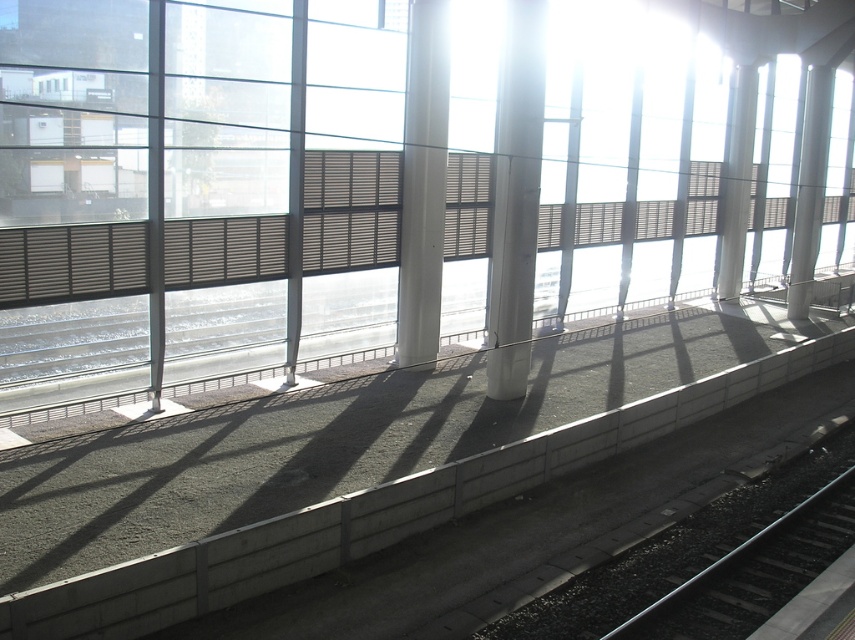
Question: Can you confirm if white smooth pillar at center is bigger than white glossy pillar at upper right?

Choices:
 (A) yes
 (B) no

Answer: (A)

Question: Which point appears farthest from the camera in this image?

Choices:
 (A) (429, 323)
 (B) (741, 108)
 (C) (528, 100)
 (D) (803, 288)

Answer: (B)

Question: Which object is the farthest from the white smooth pillar at right?

Choices:
 (A) white glossy pillar at center
 (B) white glossy pillar at upper right

Answer: (A)

Question: In this image, where is white smooth pillar at right located relative to white glossy pillar at upper right?

Choices:
 (A) above
 (B) below

Answer: (A)

Question: Can you confirm if white smooth pillar at center is positioned above white smooth pillar at right?

Choices:
 (A) no
 (B) yes

Answer: (A)

Question: Which point is closer to the camera?

Choices:
 (A) white glossy pillar at center
 (B) white smooth pillar at right

Answer: (A)